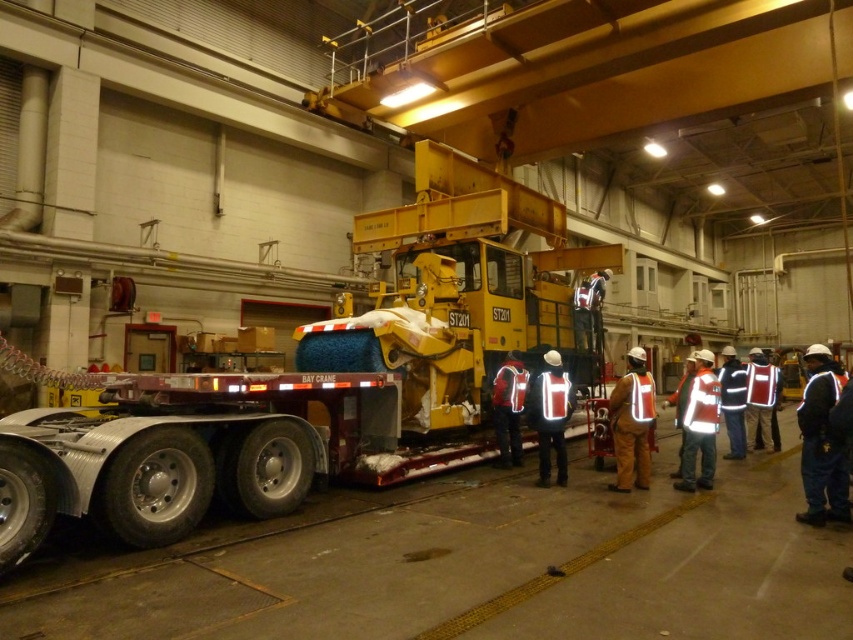
You are an inspector checking safety gear in the warehouse. You notice two safety vests, the reflective fabric safety vest at right and the white reflective vest at center. Which vest is wider?

The reflective fabric safety vest at right is wider than the white reflective vest at center.

You are a delivery driver who needs to park your truck, which is 2.5 meters long, in the space between the reflective fabric safety vest at right and the red reflective vest at right. Can your truck fit in that space?

The distance between the reflective fabric safety vest at right and the red reflective vest at right is 2.56 meters, so yes, the truck can fit as it is slightly longer than the truck.